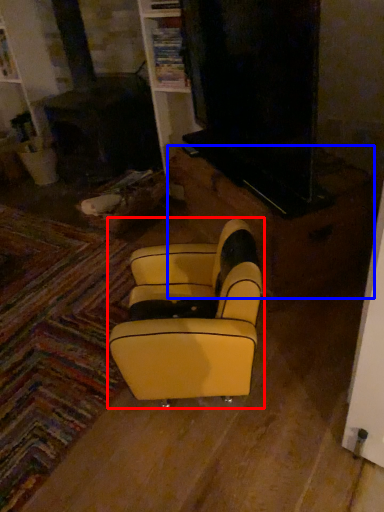
Question: Which of the following is the closest to the observer, rocking chair (highlighted by a red box) or furniture (highlighted by a blue box)?

Choices:
 (A) rocking chair
 (B) furniture

Answer: (A)